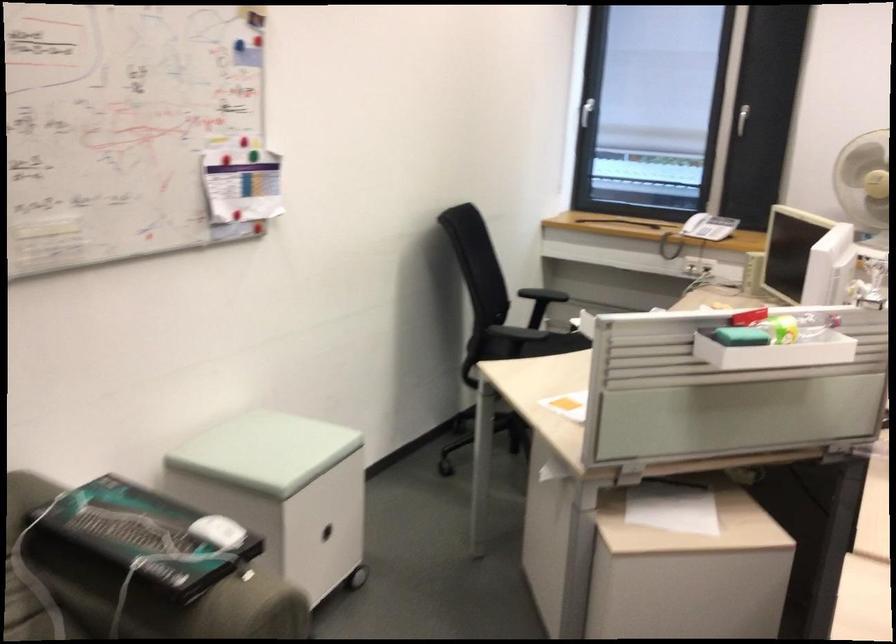
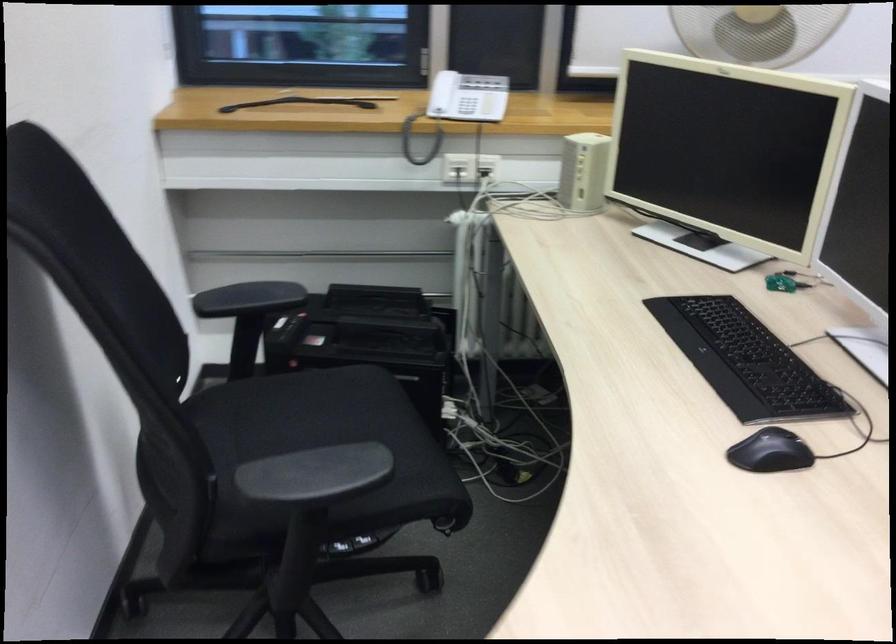
Locate, in the second image, the point that corresponds to the point at 716,231 in the first image.

(459, 106)